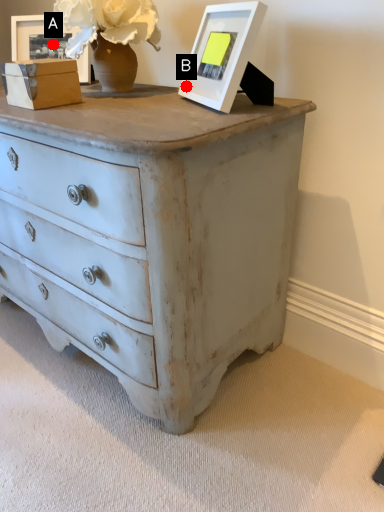
Question: Two points are circled on the image, labeled by A and B beside each circle. Among these points, which one is nearest to the camera?

Choices:
 (A) A is closer
 (B) B is closer

Answer: (B)